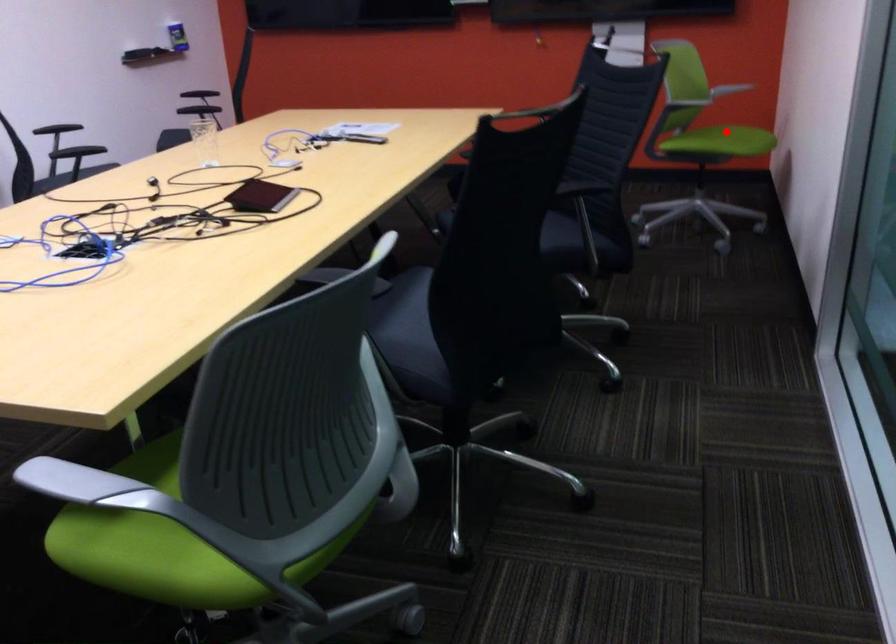
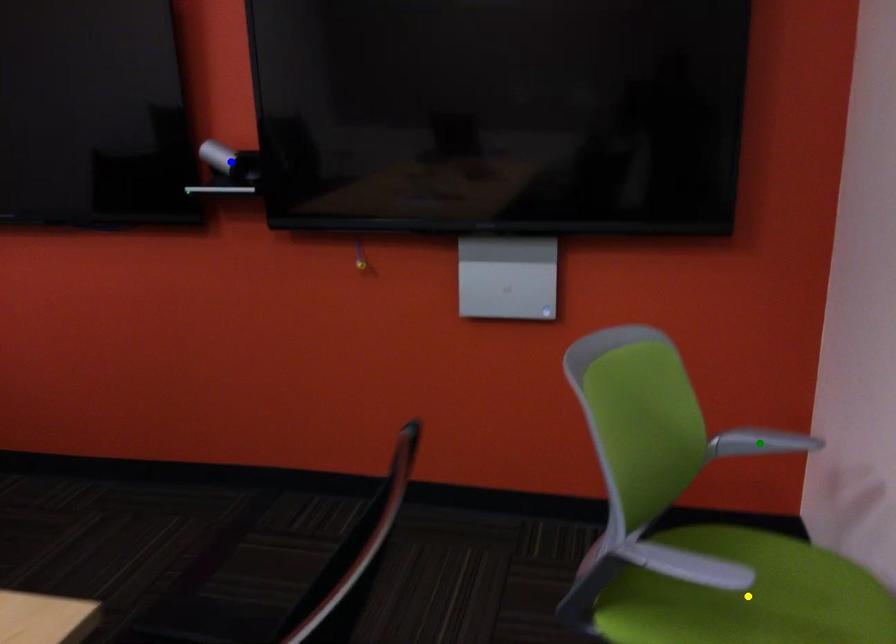
Question: I am providing you with two images of the same scene from different viewpoints. A red point is marked on the first image. You are given multiple points on the second image. Which spot in image 2 lines up with the point in image 1?

Choices:
 (A) green point
 (B) yellow point
 (C) blue point

Answer: (B)